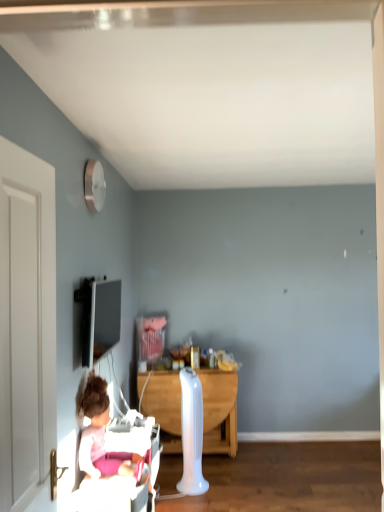
Question: From a real-world perspective, is matte black tv at upper left positioned above or below wooden desk at center?

Choices:
 (A) below
 (B) above

Answer: (B)

Question: Is matte black tv at upper left bigger or smaller than wooden desk at center?

Choices:
 (A) small
 (B) big

Answer: (A)

Question: Estimate the real-world distances between objects in this image. Which object is farther from the matte black tv at upper left?

Choices:
 (A) white plastic radiator at center
 (B) white wooden door at left
 (C) pink fabric doll at lower left
 (D) wooden desk at center

Answer: (B)

Question: Which is farther from the white plastic radiator at center?

Choices:
 (A) white wooden door at left
 (B) wooden desk at center
 (C) matte black tv at upper left
 (D) pink fabric doll at lower left

Answer: (A)